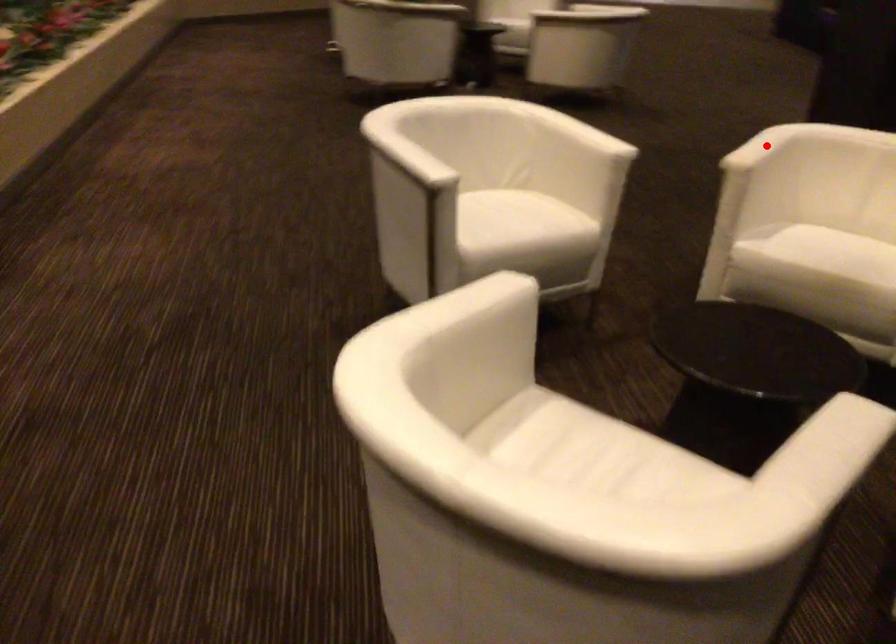
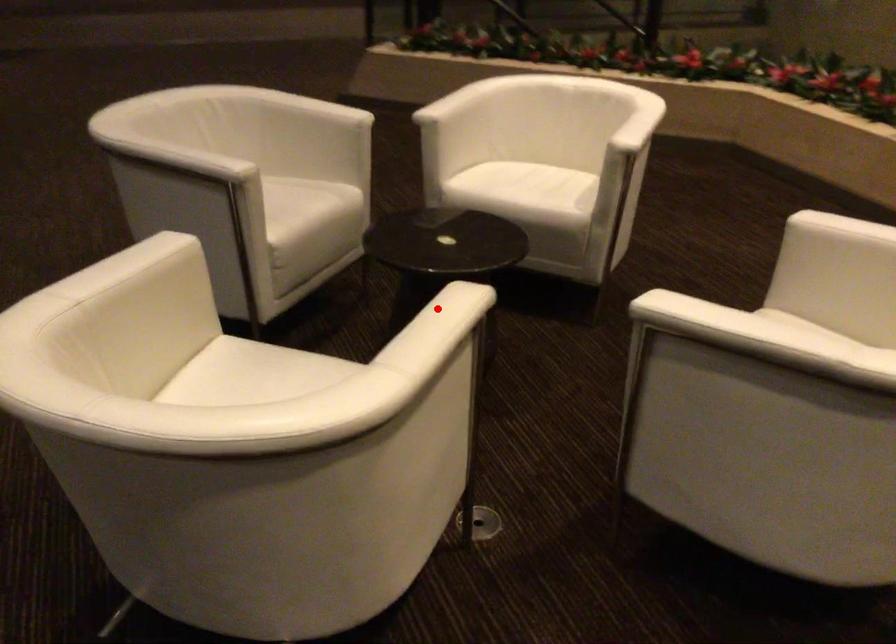
I am providing you with two images of the same scene from different viewpoints. A red point is marked on the first image and another point is marked on the second image. Is the red point in image1 aligned with the point shown in image2?

Yes